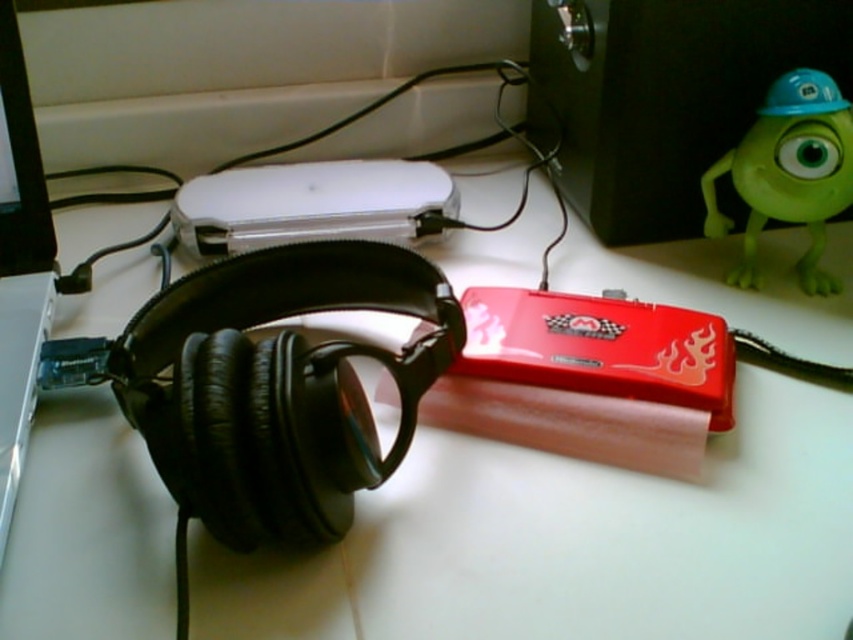
Is white glossy ipod at center taller than green rubber toy at upper right?

Incorrect, white glossy ipod at center's height is not larger of green rubber toy at upper right's.

Does point (364, 163) come farther from viewer compared to point (780, 141)?

Yes.

You are a GUI agent. You are given a task and a screenshot of the screen. Output one action in this format:
    pyautogui.click(x=<x>, y=<y>)
    Task: Click on the white glossy ipod at center
    
    Given the screenshot: What is the action you would take?
    click(311, 204)